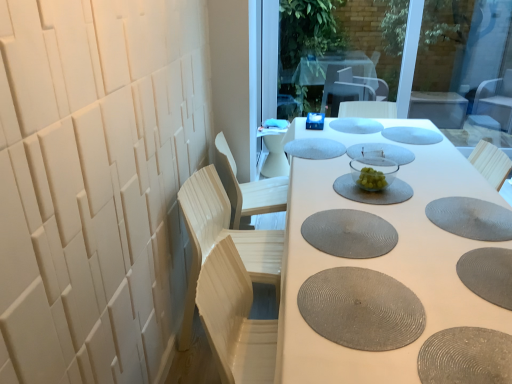
You are a GUI agent. You are given a task and a screenshot of the screen. Output one action in this format:
    pyautogui.click(x=<x>, y=<y>)
    Task: Click on the vacant region below gray textured placemat at lower right, the 6th manhole cover in the back-to-front sequence (from a real-world perspective)
    
    Given the screenshot: What is the action you would take?
    pyautogui.click(x=467, y=216)